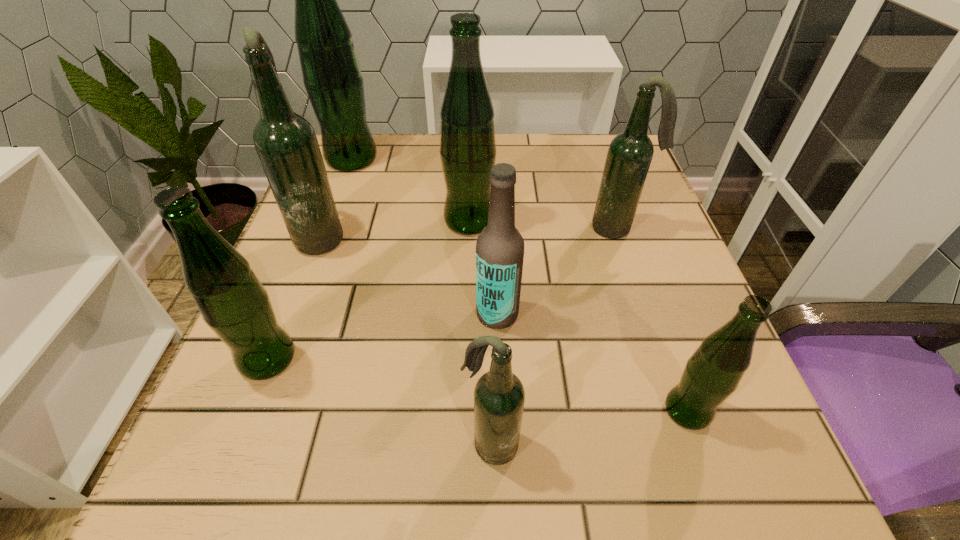
You are a GUI agent. You are given a task and a screenshot of the screen. Output one action in this format:
    pyautogui.click(x=<x>, y=<y>)
    Task: Click on the vacant point that satisfies the following two spatial constraints: 1. on the label of the fifth farthest object; 2. on the front side of the third farthest green beer bottle
    The width and height of the screenshot is (960, 540).
    Given the screenshot: What is the action you would take?
    499,359

Locate an element on the screen. The width and height of the screenshot is (960, 540). free space that satisfies the following two spatial constraints: 1. on the front side of the smallest dark beer bottle; 2. on the right side of the sixth farthest beer bottle is located at coordinates (234, 444).

Identify the location of vacant space that satisfies the following two spatial constraints: 1. on the front side of the second biggest dark beer bottle; 2. on the left side of the nearest green beer bottle. The height and width of the screenshot is (540, 960). (680, 410).

The width and height of the screenshot is (960, 540). I want to click on vacant space that satisfies the following two spatial constraints: 1. on the back side of the rightmost dark beer bottle; 2. on the right side of the leftmost dark beer bottle, so [324, 228].